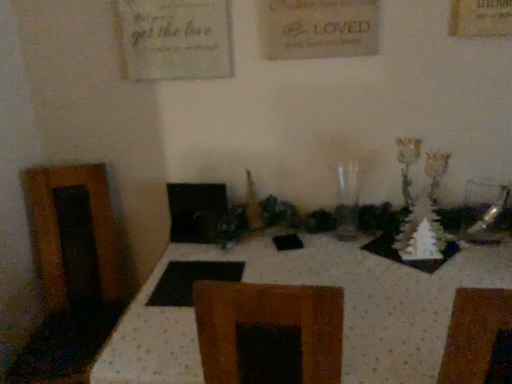
Question: Can we say transparent glass vase at center lies outside white dotted fabric at center?

Choices:
 (A) yes
 (B) no

Answer: (A)

Question: Is transparent glass vase at center aimed at white dotted fabric at center?

Choices:
 (A) yes
 (B) no

Answer: (B)

Question: Can you confirm if transparent glass vase at center is wider than white dotted fabric at center?

Choices:
 (A) yes
 (B) no

Answer: (B)

Question: Is transparent glass vase at center positioned in front of white dotted fabric at center?

Choices:
 (A) yes
 (B) no

Answer: (B)

Question: Would you say transparent glass vase at center is a long distance from white dotted fabric at center?

Choices:
 (A) yes
 (B) no

Answer: (B)

Question: Is transparent glass vase at center at the left side of white dotted fabric at center?

Choices:
 (A) yes
 (B) no

Answer: (B)

Question: Can you confirm if white dotted fabric at center is taller than transparent glass vase at center?

Choices:
 (A) yes
 (B) no

Answer: (A)

Question: Does white dotted fabric at center have a smaller size compared to transparent glass vase at center?

Choices:
 (A) no
 (B) yes

Answer: (A)

Question: Is white dotted fabric at center positioned far away from transparent glass vase at center?

Choices:
 (A) no
 (B) yes

Answer: (A)

Question: Considering the relative sizes of white dotted fabric at center and transparent glass vase at center in the image provided, is white dotted fabric at center shorter than transparent glass vase at center?

Choices:
 (A) no
 (B) yes

Answer: (A)

Question: Does white dotted fabric at center lie behind transparent glass vase at center?

Choices:
 (A) no
 (B) yes

Answer: (A)

Question: Can you confirm if white dotted fabric at center is thinner than transparent glass vase at center?

Choices:
 (A) no
 (B) yes

Answer: (A)

Question: Considering their positions, is transparent glass vase at center located in front of or behind white dotted fabric at center?

Choices:
 (A) behind
 (B) front

Answer: (A)